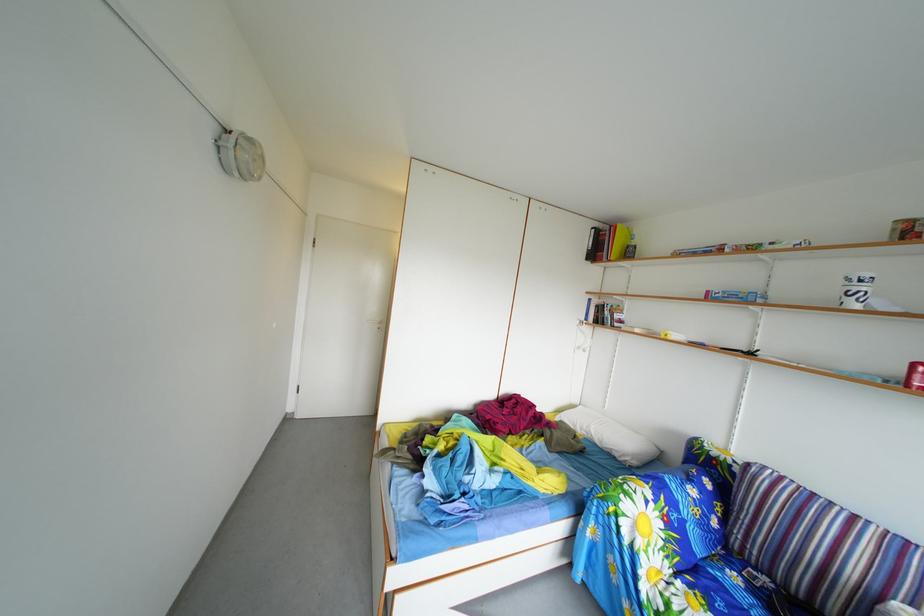
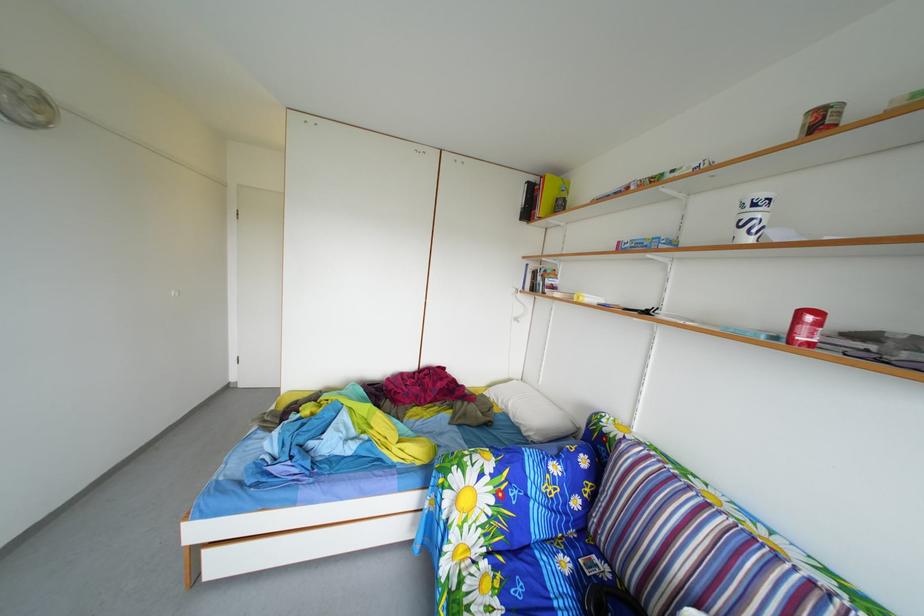
In the second image, find the point that corresponds to point 597,252 in the first image.

(530, 208)